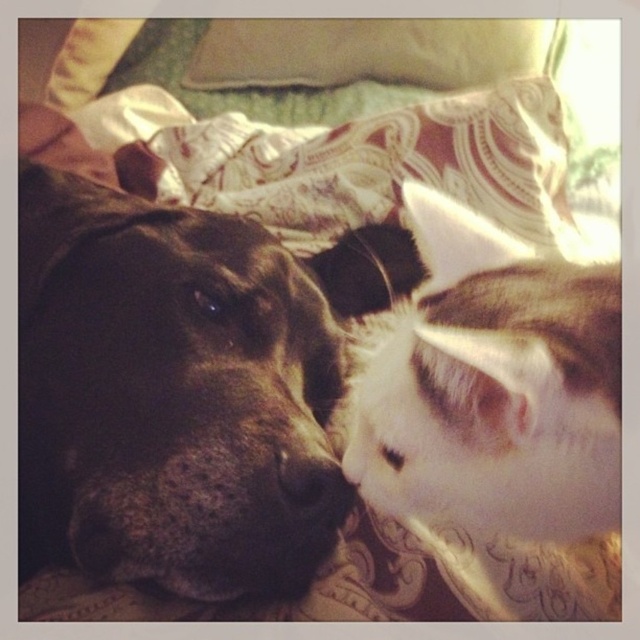
Question: Is black fur dog at center to the left of white matte nose at center from the viewer's perspective?

Choices:
 (A) yes
 (B) no

Answer: (A)

Question: Which of these objects is positioned farthest from the black fur dog at center?

Choices:
 (A) white fluffy cat at center
 (B) white matte nose at center

Answer: (B)

Question: Which object appears farthest from the camera in this image?

Choices:
 (A) white fluffy cat at center
 (B) white matte nose at center

Answer: (B)

Question: Does white fluffy cat at center appear over white matte nose at center?

Choices:
 (A) no
 (B) yes

Answer: (B)

Question: Which of these objects is positioned closest to the black fur dog at center?

Choices:
 (A) white matte nose at center
 (B) velvet beige pillow at upper center

Answer: (A)

Question: Is black fur dog at center positioned before velvet beige pillow at upper center?

Choices:
 (A) yes
 (B) no

Answer: (A)